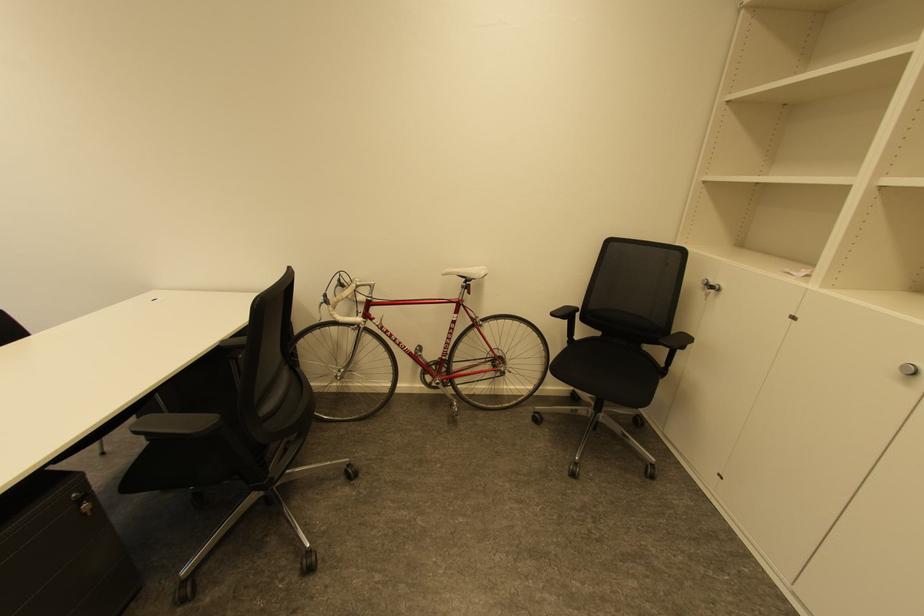
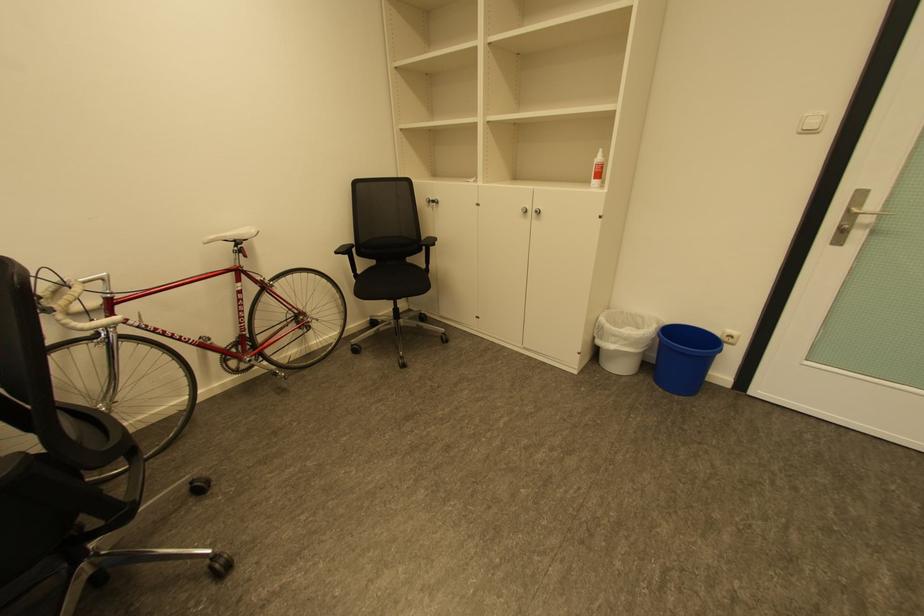
Question: How did the camera likely rotate?

Choices:
 (A) Left
 (B) Right
 (C) Up
 (D) Down

Answer: (B)